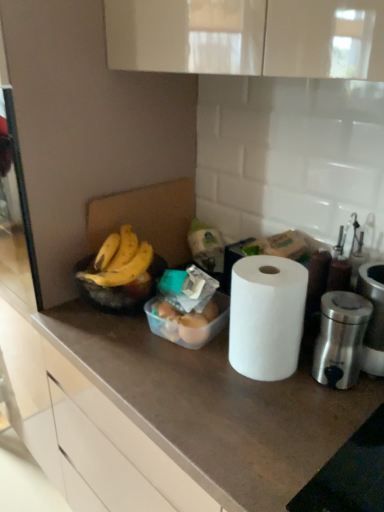
Identify the location of free location in front of translucent plastic eggs at center. (180, 375).